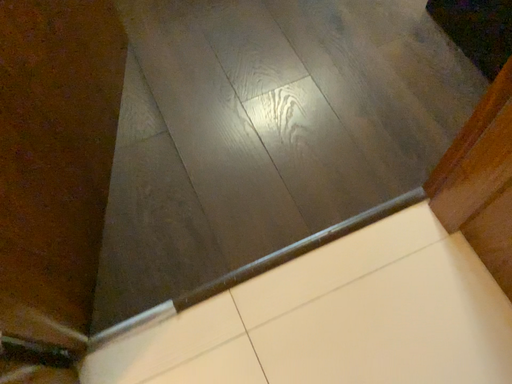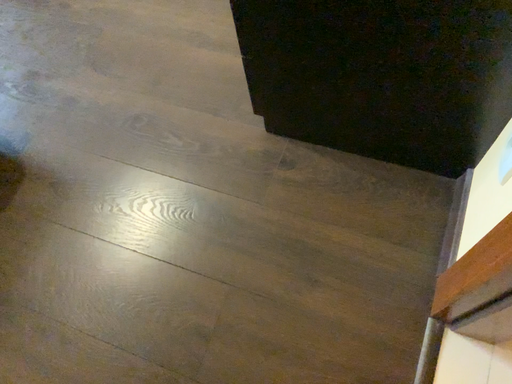
Question: Which way did the camera rotate in the video?

Choices:
 (A) rotated downward
 (B) rotated upward

Answer: (B)